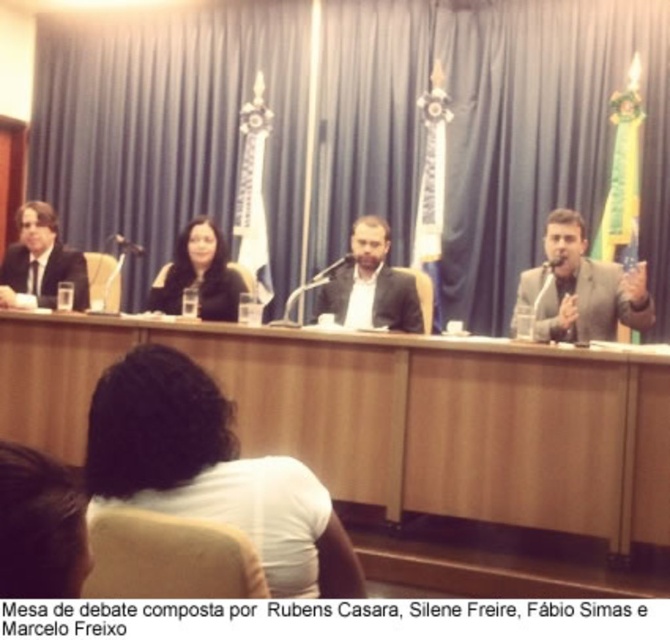
You are an event organizer arranging a photo shoot for the panel discussion. You need to position a spotlight exactly at the center of the white fabric shirt at center. Using the coordinate system where the bottom left corner is the origin, can you confirm if the point at (210, 472) is indeed the center of the white fabric shirt at center?

Yes, the point at (210, 472) is the center of the white fabric shirt at center as per the provided coordinates.

You are an event organizer arranging a photo shoot for the panel discussion. You need to position a spotlight on the matte black suit at left and the matte black jacket at center. Since the spotlight can only illuminate one person at a time, which person should you focus on first if you want to ensure the spotlight reaches both without moving it? Explain your reasoning based on their positions.

The matte black jacket at center is behind the matte black suit at left. Therefore, you should first focus the spotlight on the matte black suit at left, as it is in front. Once lit, the spotlight can then naturally extend to the matte black jacket at center without needing to adjust the position, since the jacket is behind and within the same line of sight.